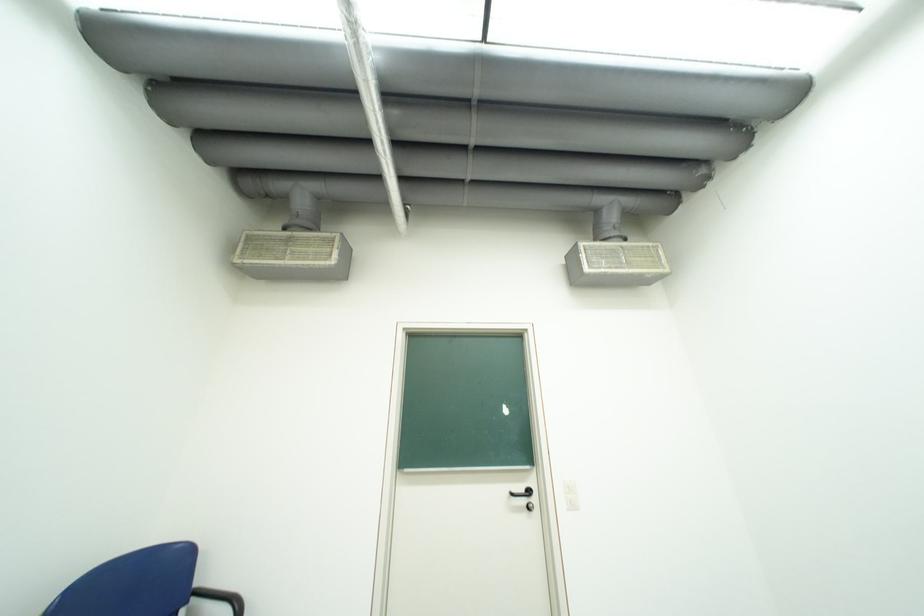
Describe the element at coordinates (521, 493) in the screenshot. Image resolution: width=924 pixels, height=616 pixels. I see `the black door handle` at that location.